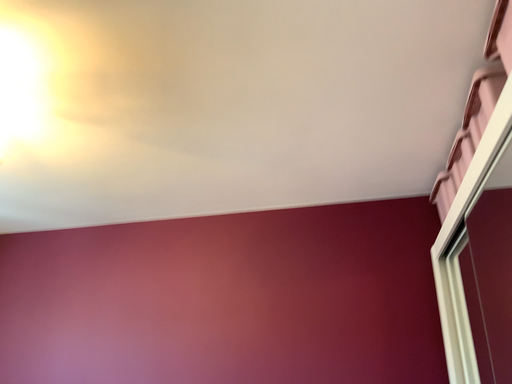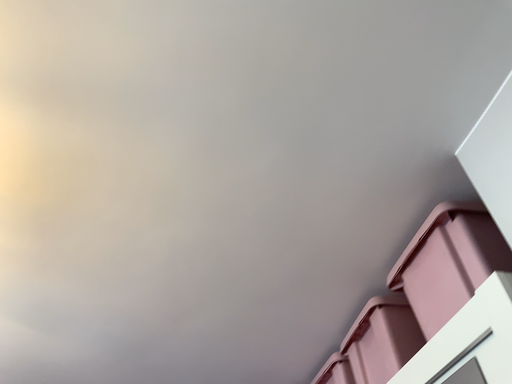
Question: Which way did the camera rotate in the video?

Choices:
 (A) rotated left
 (B) rotated right

Answer: (B)